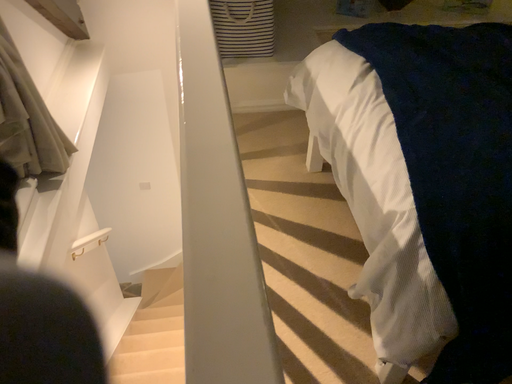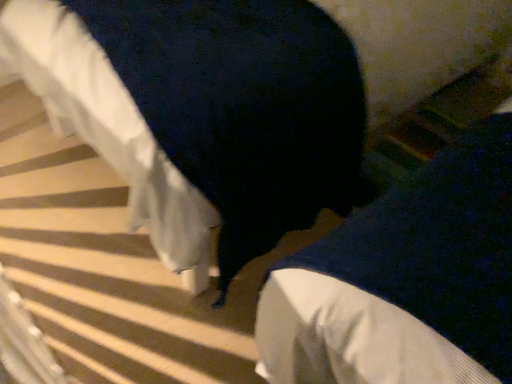
Question: Which way did the camera rotate in the video?

Choices:
 (A) rotated left
 (B) rotated right

Answer: (B)